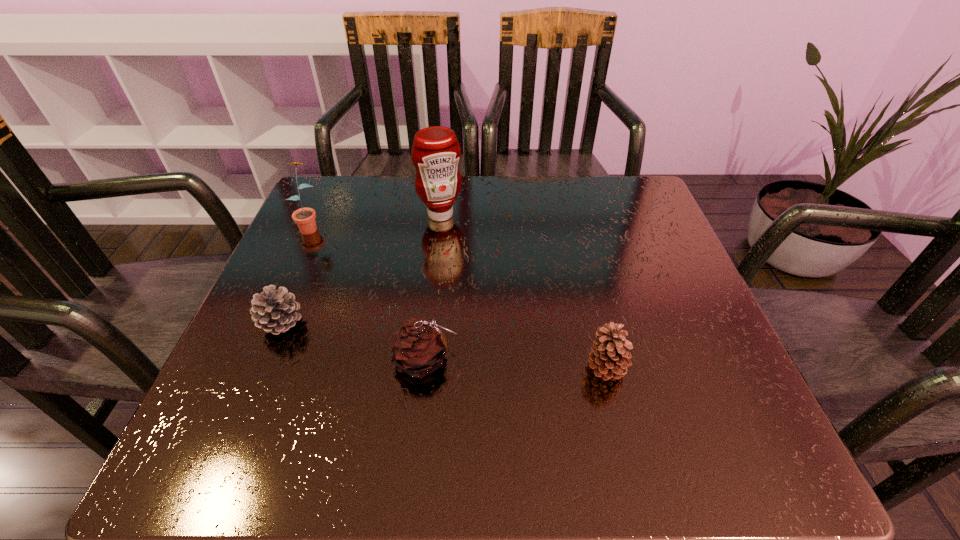
Locate an element on the screen. vacant space at the far left corner is located at coordinates (344, 201).

This screenshot has height=540, width=960. I want to click on vacant space at the far right corner of the desktop, so click(597, 216).

Locate an element on the screen. empty space between the sunflower and the shortest pinecone is located at coordinates (296, 274).

Identify the location of free spot between the condiment and the shortest object. (361, 269).

Where is `vacant region between the shortest pinecone and the second pinecone from left to right`? This screenshot has width=960, height=540. vacant region between the shortest pinecone and the second pinecone from left to right is located at coordinates (354, 342).

Where is `free spot between the tallest object and the leftmost pinecone`? free spot between the tallest object and the leftmost pinecone is located at coordinates (361, 269).

Image resolution: width=960 pixels, height=540 pixels. In order to click on vacant area that lies between the condiment and the shortest object in this screenshot , I will do `click(361, 269)`.

Find the location of a particular element. The width and height of the screenshot is (960, 540). free point between the fourth shortest object and the rightmost object is located at coordinates (458, 296).

Find the location of `free space between the condiment and the rightmost object`. free space between the condiment and the rightmost object is located at coordinates 523,291.

Identify the location of empty space that is in between the second tallest object and the tallest object. (375, 220).